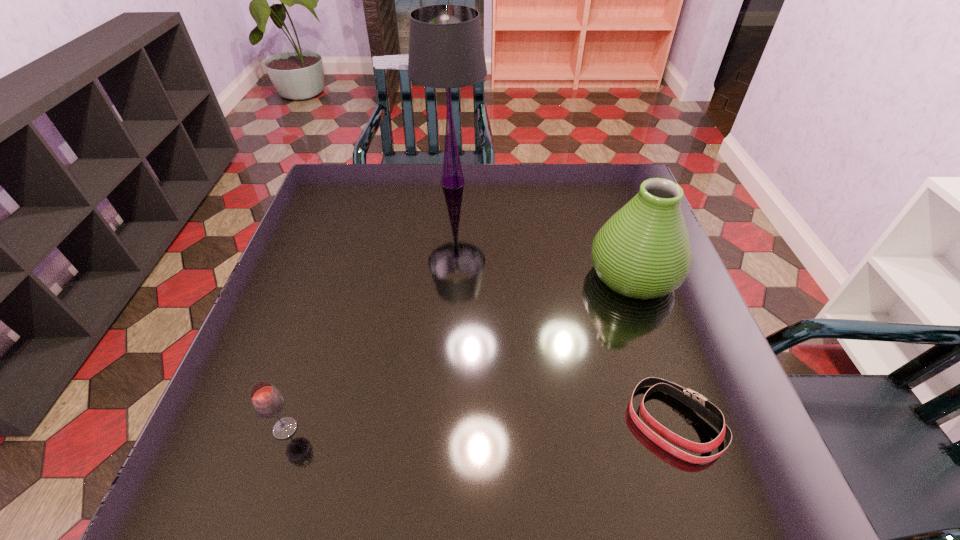
Where is `free space at the right edge of the desktop`? The height and width of the screenshot is (540, 960). free space at the right edge of the desktop is located at coordinates (670, 303).

Identify the location of free space between the tallest object and the leftmost object. The image size is (960, 540). (369, 306).

You are a GUI agent. You are given a task and a screenshot of the screen. Output one action in this format:
    pyautogui.click(x=<x>, y=<y>)
    Task: Click on the vacant space that is in between the third shortest object and the farthest object
    The width and height of the screenshot is (960, 540).
    Given the screenshot: What is the action you would take?
    pyautogui.click(x=543, y=228)

Locate an element on the screen. The width and height of the screenshot is (960, 540). free space between the dog collar and the second farthest object is located at coordinates (654, 349).

Locate an element on the screen. The width and height of the screenshot is (960, 540). free space between the vase and the dog collar is located at coordinates (654, 349).

Locate an element on the screen. The height and width of the screenshot is (540, 960). vacant space in between the tallest object and the dog collar is located at coordinates (564, 302).

The width and height of the screenshot is (960, 540). Identify the location of vacant area that lies between the second farthest object and the lampshade. (543, 228).

The width and height of the screenshot is (960, 540). I want to click on vacant space that's between the tallest object and the glass drink container, so click(x=369, y=306).

Where is `free space between the third tallest object and the lampshade`? free space between the third tallest object and the lampshade is located at coordinates (369, 306).

This screenshot has width=960, height=540. Find the location of `vacant region between the leftmost object and the tallest object`. vacant region between the leftmost object and the tallest object is located at coordinates (369, 306).